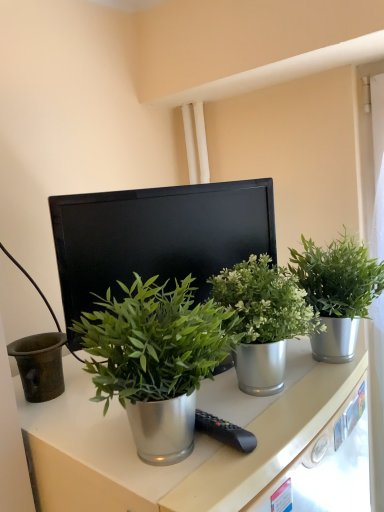
Question: From a real-world perspective, is metallic green plant at center, the second houseplant viewed from the right, positioned above or below black matte computer monitor at center?

Choices:
 (A) below
 (B) above

Answer: (A)

Question: Considering their positions, is metallic green plant at center, which is counted as the 2th houseplant, starting from the left, located in front of or behind black matte computer monitor at center?

Choices:
 (A) behind
 (B) front

Answer: (B)

Question: Estimate the real-world distances between objects in this image. Which object is closer to the metallic green plant at center, the second houseplant viewed from the right?

Choices:
 (A) green metallic plant at center, which is the first houseplant from right to left
 (B) black matte computer monitor at center
 (C) metallic drawer at lower right
 (D) green metallic plant at center, which ranks as the first houseplant in left-to-right order

Answer: (A)

Question: Based on their relative distances, which object is nearer to the green metallic plant at center, which ranks as the first houseplant in left-to-right order?

Choices:
 (A) metallic drawer at lower right
 (B) metallic green plant at center, the second houseplant viewed from the right
 (C) green metallic plant at center, which ranks as the third houseplant in left-to-right order
 (D) black matte computer monitor at center

Answer: (B)